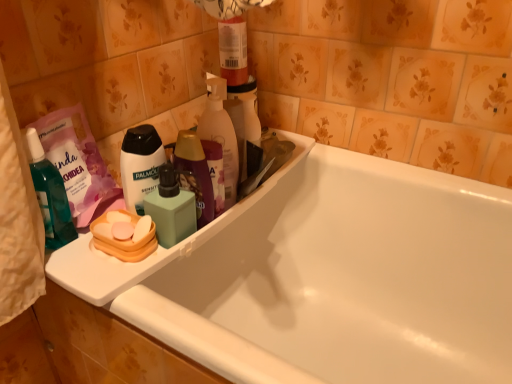
The width and height of the screenshot is (512, 384). I want to click on vacant space in front of white matte body wash at center, arranged as the 1th personal care when viewed from the top, so click(120, 276).